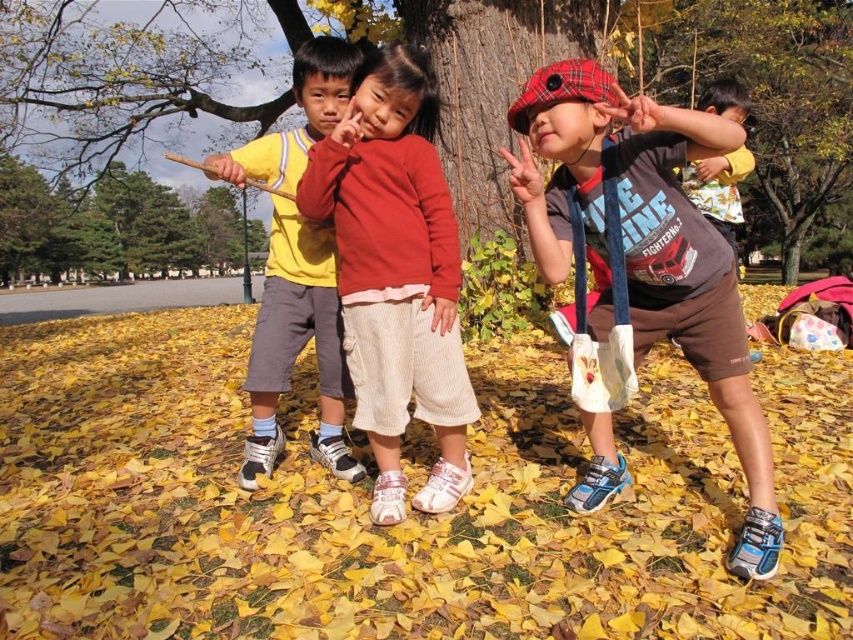
Question: Can you confirm if green leafy tree at left is wider than matte yellow shirt at upper right?

Choices:
 (A) no
 (B) yes

Answer: (A)

Question: Which point is farther from the camera taking this photo?

Choices:
 (A) (373, 413)
 (B) (795, 259)
 (C) (608, 486)

Answer: (B)

Question: Which point is farther from the camera taking this photo?

Choices:
 (A) (297, 342)
 (B) (234, 209)
 (C) (706, 160)

Answer: (B)

Question: Does matte brown shorts at center have a larger size compared to matte yellow shirt at upper right?

Choices:
 (A) no
 (B) yes

Answer: (B)

Question: Which point appears farthest from the camera in this image?

Choices:
 (A) (730, 237)
 (B) (714, 17)
 (C) (42, 200)

Answer: (C)

Question: Where is matte brown shorts at center located in relation to green leafy tree at left in the image?

Choices:
 (A) above
 (B) below

Answer: (B)